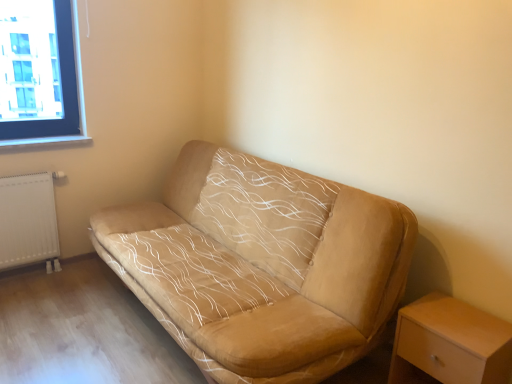
Question: From a real-world perspective, is white matte radiator at lower left located beneath light wood/wooden nightstand at lower right?

Choices:
 (A) no
 (B) yes

Answer: (A)

Question: Is white matte radiator at lower left shorter than light wood/wooden nightstand at lower right?

Choices:
 (A) yes
 (B) no

Answer: (B)

Question: Is white matte radiator at lower left further to the viewer compared to light wood/wooden nightstand at lower right?

Choices:
 (A) no
 (B) yes

Answer: (B)

Question: From the image's perspective, is white matte radiator at lower left below light wood/wooden nightstand at lower right?

Choices:
 (A) yes
 (B) no

Answer: (B)

Question: Considering the relative sizes of white matte radiator at lower left and light wood/wooden nightstand at lower right in the image provided, is white matte radiator at lower left thinner than light wood/wooden nightstand at lower right?

Choices:
 (A) yes
 (B) no

Answer: (A)

Question: Is suede beige couch at center inside or outside of white matte radiator at lower left?

Choices:
 (A) outside
 (B) inside

Answer: (A)

Question: In terms of height, does suede beige couch at center look taller or shorter compared to white matte radiator at lower left?

Choices:
 (A) short
 (B) tall

Answer: (B)

Question: From a real-world perspective, is suede beige couch at center positioned above or below white matte radiator at lower left?

Choices:
 (A) above
 (B) below

Answer: (A)

Question: Would you say suede beige couch at center is to the left or to the right of white matte radiator at lower left in the picture?

Choices:
 (A) left
 (B) right

Answer: (B)

Question: Considering the positions of white matte radiator at lower left and light wood/wooden nightstand at lower right in the image, is white matte radiator at lower left bigger or smaller than light wood/wooden nightstand at lower right?

Choices:
 (A) small
 (B) big

Answer: (A)

Question: In terms of width, does white matte radiator at lower left look wider or thinner when compared to light wood/wooden nightstand at lower right?

Choices:
 (A) thin
 (B) wide

Answer: (A)

Question: Is white matte radiator at lower left to the left or to the right of light wood/wooden nightstand at lower right in the image?

Choices:
 (A) right
 (B) left

Answer: (B)

Question: From the image's perspective, is white matte radiator at lower left located above or below light wood/wooden nightstand at lower right?

Choices:
 (A) below
 (B) above

Answer: (B)

Question: Considering the relative positions of light wood/wooden nightstand at lower right and suede beige couch at center in the image provided, is light wood/wooden nightstand at lower right to the left or to the right of suede beige couch at center?

Choices:
 (A) left
 (B) right

Answer: (B)

Question: Considering their positions, is light wood/wooden nightstand at lower right located in front of or behind suede beige couch at center?

Choices:
 (A) front
 (B) behind

Answer: (B)